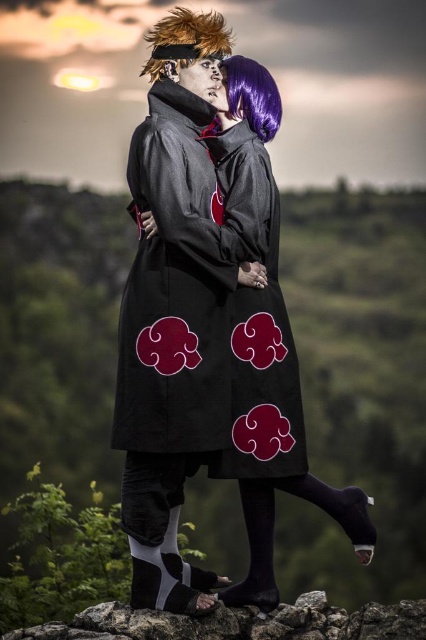
Question: Does black fabric coat at center have a smaller size compared to spiky orange hair at upper left?

Choices:
 (A) no
 (B) yes

Answer: (A)

Question: Is spiky orange hair at upper left below purple silky wig at upper center?

Choices:
 (A) yes
 (B) no

Answer: (B)

Question: Which of the following is the farthest from the observer?

Choices:
 (A) (219, 35)
 (B) (192, 435)
 (C) (233, 76)

Answer: (C)

Question: Does spiky orange hair at upper left come in front of purple silky wig at upper center?

Choices:
 (A) no
 (B) yes

Answer: (B)

Question: Which point appears farthest from the camera in this image?

Choices:
 (A) (276, 86)
 (B) (172, 45)
 (C) (224, 323)
 (D) (302, 637)

Answer: (A)

Question: Which object is farther from the camera taking this photo?

Choices:
 (A) smooth rock at lower center
 (B) black fabric cloak at center
 (C) spiky orange hair at upper left
 (D) purple silky wig at upper center

Answer: (D)